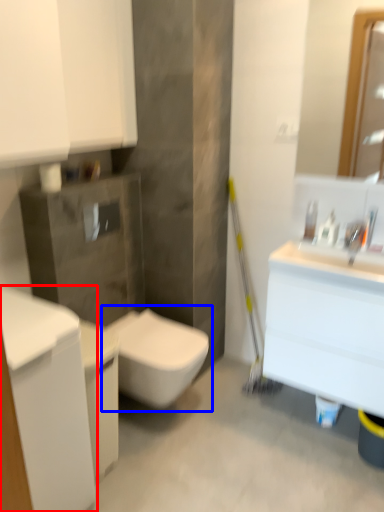
Question: Which object appears farthest to the camera in this image, cabinetry (highlighted by a red box) or toilet (highlighted by a blue box)?

Choices:
 (A) cabinetry
 (B) toilet

Answer: (B)